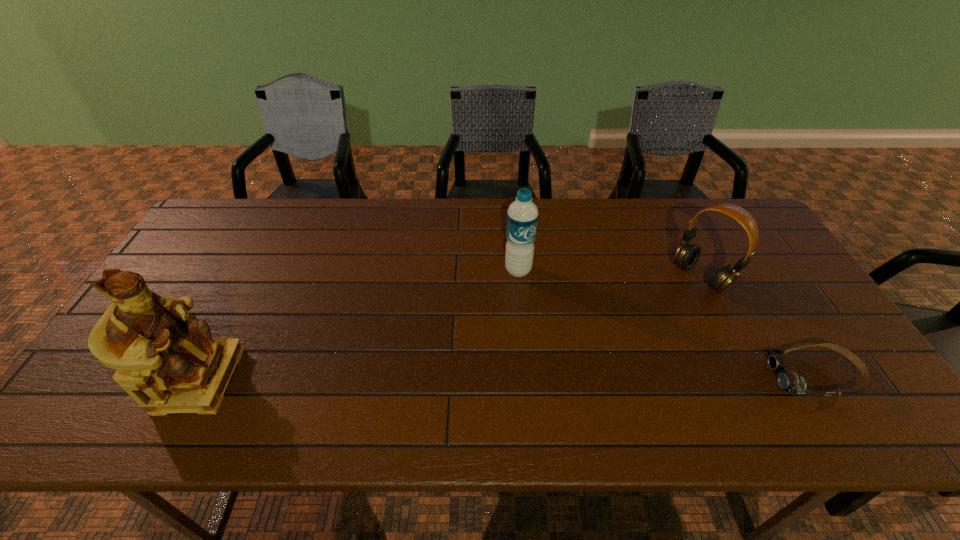
Identify the location of vacant space at the far edge. The height and width of the screenshot is (540, 960). (433, 229).

This screenshot has height=540, width=960. I want to click on free point at the near edge, so click(x=689, y=368).

The image size is (960, 540). In order to click on vacant space at the right edge in this screenshot , I will do `click(779, 298)`.

Where is `free location at the near right corner of the desktop`? free location at the near right corner of the desktop is located at coordinates [836, 392].

You are a GUI agent. You are given a task and a screenshot of the screen. Output one action in this format:
    pyautogui.click(x=<x>, y=<y>)
    Task: Click on the vacant point located between the leftmost object and the water bottle
    The image size is (960, 540).
    Given the screenshot: What is the action you would take?
    pyautogui.click(x=359, y=325)

You are a GUI agent. You are given a task and a screenshot of the screen. Output one action in this format:
    pyautogui.click(x=<x>, y=<y>)
    Task: Click on the free space between the goggles and the leftmost object
    The height and width of the screenshot is (540, 960).
    Given the screenshot: What is the action you would take?
    pyautogui.click(x=507, y=378)

Image resolution: width=960 pixels, height=540 pixels. I want to click on vacant area that lies between the goggles and the second tallest object, so click(666, 323).

You are a GUI agent. You are given a task and a screenshot of the screen. Output one action in this format:
    pyautogui.click(x=<x>, y=<y>)
    Task: Click on the vacant space that's between the third tallest object and the goggles
    
    Given the screenshot: What is the action you would take?
    pyautogui.click(x=757, y=327)

The image size is (960, 540). I want to click on vacant region between the goggles and the headset, so click(757, 327).

Identify the location of unoccupied position between the figurine and the second object from left to right. This screenshot has width=960, height=540. (359, 325).